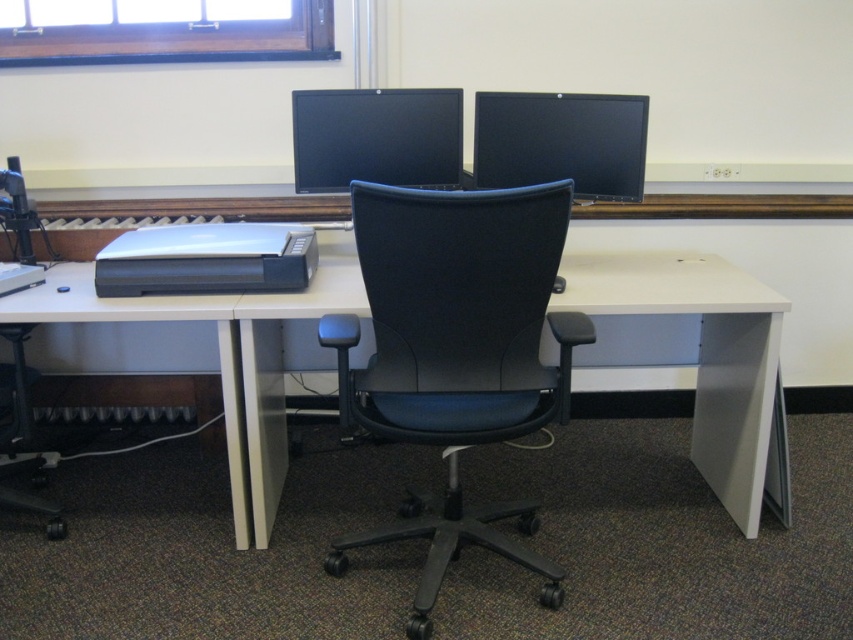
You are standing at the point with coordinates point (376, 138). What object is located exactly at your current position?

The black glossy monitor at center is located exactly at point (376, 138).

You are an office worker who needs to place a new keyboard on the desk. The keyboard is too heavy to lift, so you want to slide it from the edge of the desk closest to the monitor. Can you slide the keyboard from the edge of the white plastic desk at center towards the black glossy monitor at center?

The white plastic desk at center is positioned under the black glossy monitor at center, so sliding the keyboard from the edge of the white plastic desk at center towards the black glossy monitor at center is possible as the desk is directly beneath the monitor.